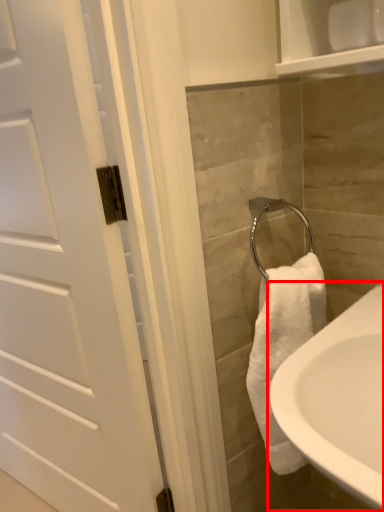
Question: From the image's perspective, where is sink (annotated by the red box) located relative to door?

Choices:
 (A) above
 (B) below

Answer: (B)